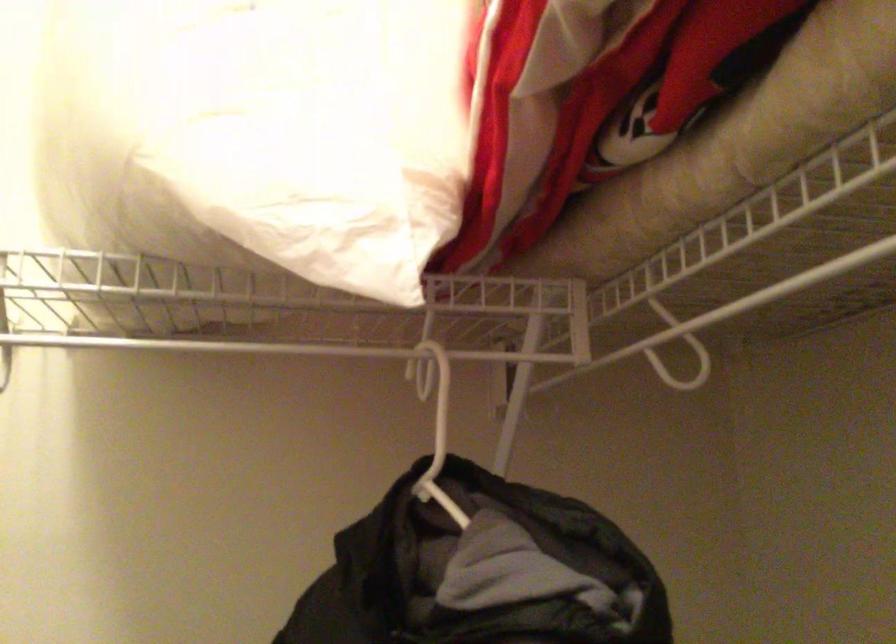
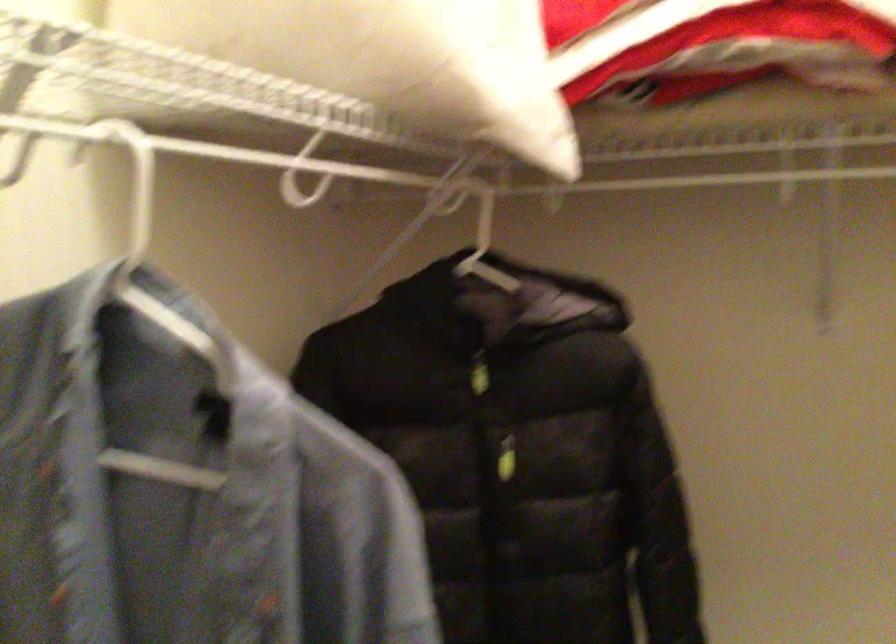
Question: The first image is from the beginning of the video and the second image is from the end. How did the camera likely rotate when shooting the video?

Choices:
 (A) Left
 (B) Right
 (C) Up
 (D) Down

Answer: (B)